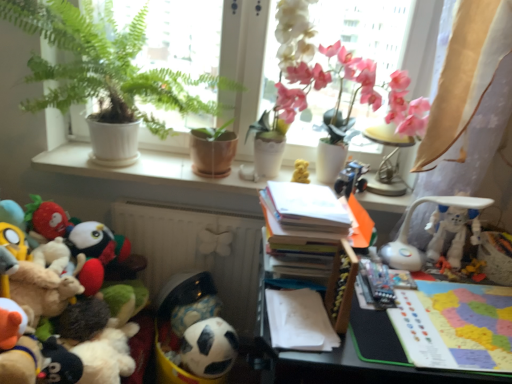
At what (x,y) coordinates should I click in order to perform the action: click on free space in front of white plastic robot at right, which is the sixth toy from left to right. Please return your answer as a coordinate pair (x, y). Looking at the image, I should click on (461, 294).